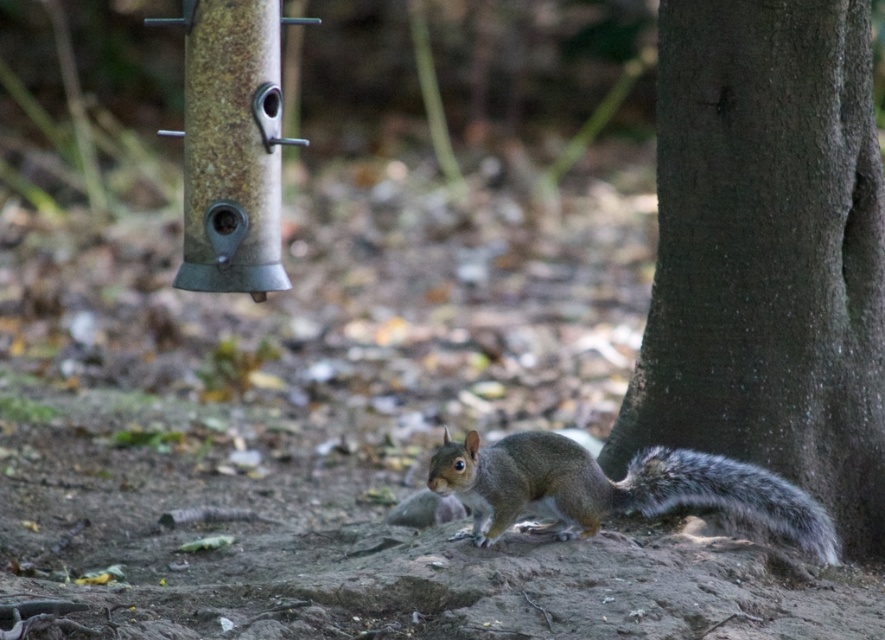
Between dark brown textured tree trunk at right and gray fur squirrel at center, which one is positioned lower?

gray fur squirrel at center

Is point (678, 440) behind point (531, 496)?

Yes, it is behind point (531, 496).

Describe the element at coordinates (767, 252) in the screenshot. I see `dark brown textured tree trunk at right` at that location.

Find the location of `dark brown textured tree trunk at right`. dark brown textured tree trunk at right is located at coordinates (767, 252).

Which of these two, dark brown textured tree trunk at right or gray furry tail at lower right, stands taller?

dark brown textured tree trunk at right

Between dark brown textured tree trunk at right and gray furry tail at lower right, which one is positioned higher?

Positioned higher is dark brown textured tree trunk at right.

The image size is (885, 640). Identify the location of dark brown textured tree trunk at right. (767, 252).

I want to click on dark brown textured tree trunk at right, so click(x=767, y=252).

Who is shorter, gray fur squirrel at center or gray furry tail at lower right?

With less height is gray furry tail at lower right.

Is gray fur squirrel at center to the left of gray furry tail at lower right from the viewer's perspective?

Yes, gray fur squirrel at center is to the left of gray furry tail at lower right.

Is point (667, 500) positioned in front of point (752, 486)?

That is False.

What are the coordinates of `gray fur squirrel at center` in the screenshot? It's located at (614, 486).